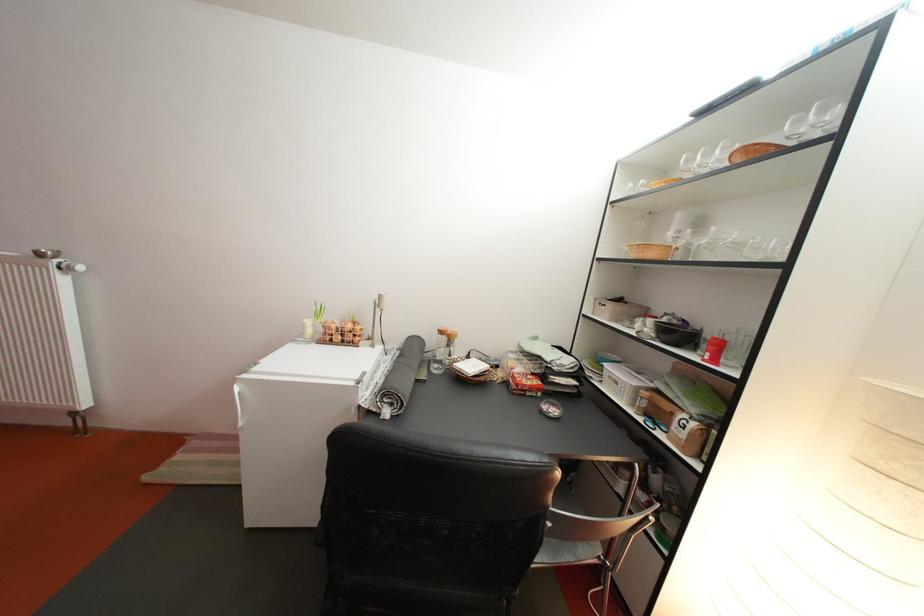
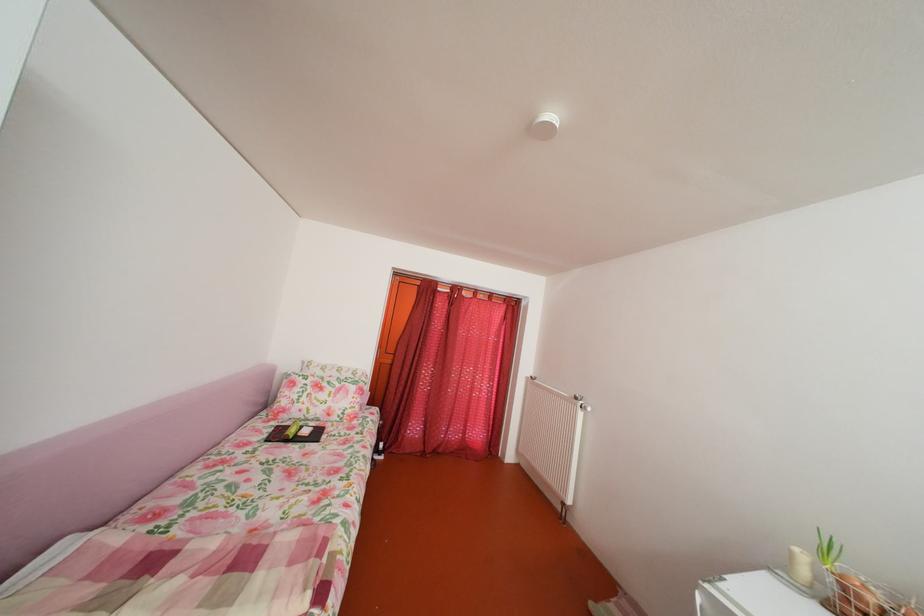
The point at (52, 261) is marked in the first image. Where is the corresponding point in the second image?

(588, 405)